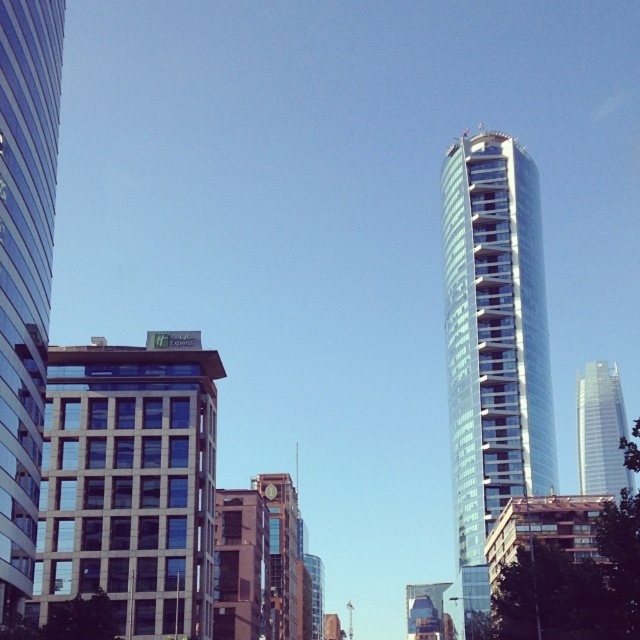
You are standing in front of the urban skyline and want to know the distance to the point marked at coordinates point (509, 468). Can you determine how far it is?

The point (509, 468) is 127.56 meters away from the viewer.

You are standing at the base of the glassy reflective skyscraper at left and want to take a photo of it. If your camera can focus on objects up to 150 feet away, will it be able to capture the entire building clearly?

The glassy reflective skyscraper at left is 142.41 feet away from the camera, which is within the camera maximum focus range of 150 feet. Therefore, the camera can capture the entire building clearly.